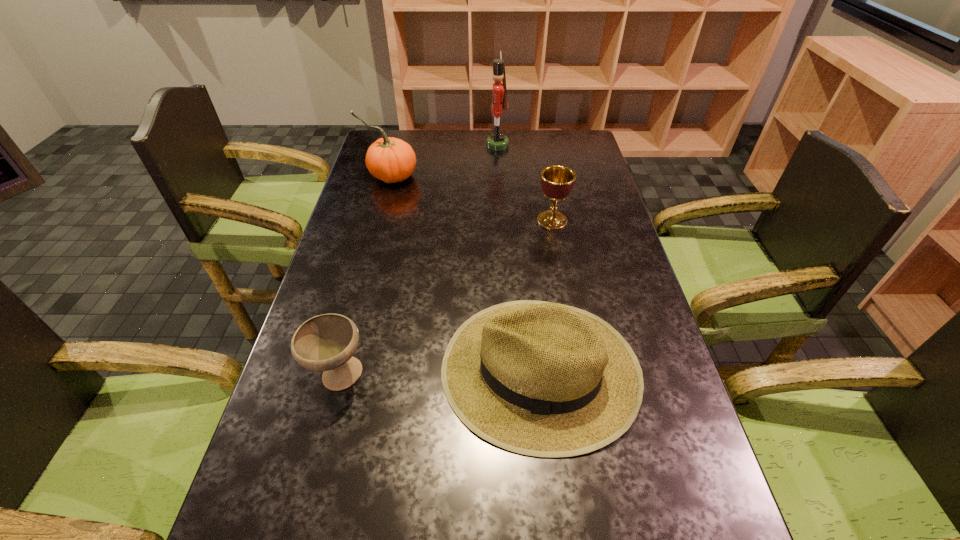
Locate an element on the screen. vacant space located on the front-facing side of the tallest object is located at coordinates (429, 145).

The height and width of the screenshot is (540, 960). What are the coordinates of `vacant area located 0.250m on the front-facing side of the tallest object` in the screenshot? It's located at (421, 145).

The width and height of the screenshot is (960, 540). I want to click on blank area located 0.090m on the right of the fourth shortest object, so click(444, 177).

You are a GUI agent. You are given a task and a screenshot of the screen. Output one action in this format:
    pyautogui.click(x=<x>, y=<y>)
    Task: Click on the free spot located on the left of the third farthest object
    
    Given the screenshot: What is the action you would take?
    pyautogui.click(x=510, y=220)

Image resolution: width=960 pixels, height=540 pixels. In order to click on blank area located 0.090m on the left of the sunhat in this screenshot , I will do `click(401, 369)`.

Where is `blank space located on the back of the nearer chalice`? The image size is (960, 540). blank space located on the back of the nearer chalice is located at coordinates (363, 287).

At what (x,y) coordinates should I click in order to perform the action: click on object at the far edge. Please return your answer as a coordinate pair (x, y). The width and height of the screenshot is (960, 540). Looking at the image, I should click on (498, 141).

This screenshot has width=960, height=540. Identify the location of pumpkin that is at the left edge. (389, 159).

The image size is (960, 540). Identify the location of chalice that is at the left edge. (327, 342).

Locate an element on the screen. This screenshot has height=540, width=960. chalice present at the right edge is located at coordinates (557, 182).